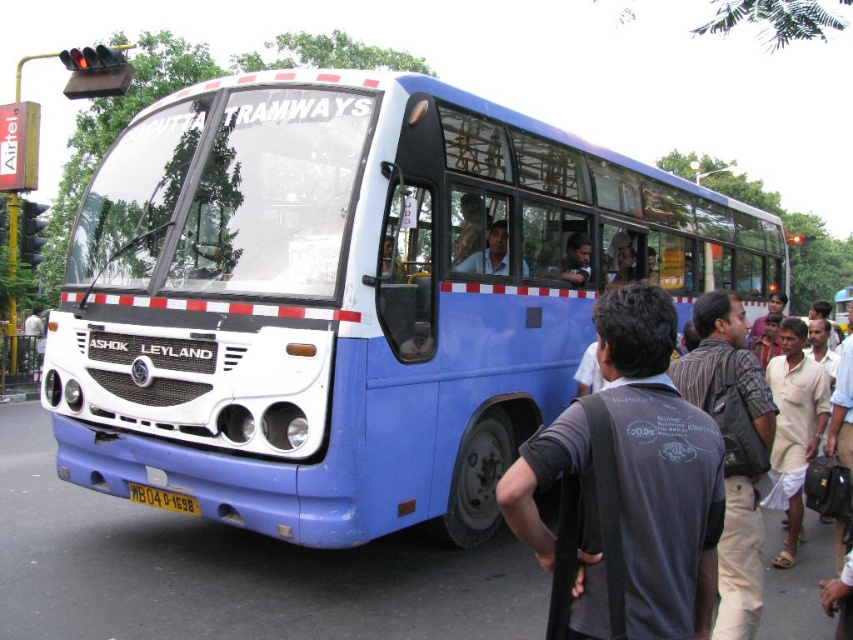
Question: Does matte blue shirt at center have a larger size compared to dark blue shirt at center?

Choices:
 (A) yes
 (B) no

Answer: (A)

Question: Estimate the real-world distances between objects in this image. Which object is closer to the dark blue shirt at center?

Choices:
 (A) blue matte bus at center
 (B) matte blue shirt at center

Answer: (B)

Question: Which of the following is the closest to the observer?

Choices:
 (A) yellow metallic license plate at center
 (B) dark gray fabric vest at center
 (C) matte blue shirt at center

Answer: (B)

Question: Which object is positioned closest to the matte blue shirt at center?

Choices:
 (A) yellow metallic license plate at center
 (B) dark blue shirt at center
 (C) dark gray fabric vest at center

Answer: (B)

Question: Does blue matte bus at center lie in front of dark gray fabric vest at center?

Choices:
 (A) no
 (B) yes

Answer: (A)

Question: Is blue matte bus at center smaller than matte blue shirt at center?

Choices:
 (A) no
 (B) yes

Answer: (B)